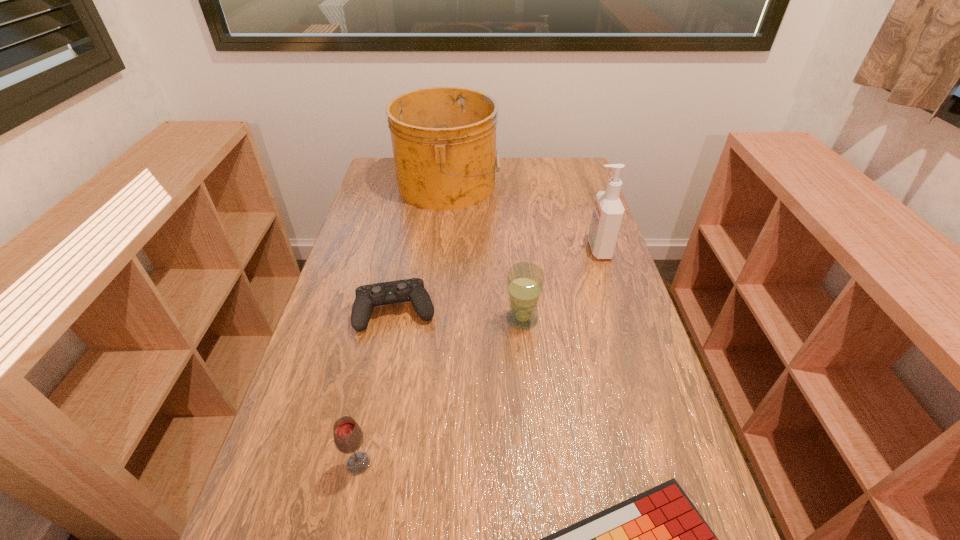
Identify the location of the closest object to the shortest object. The image size is (960, 540). (348, 437).

The image size is (960, 540). What are the coordinates of `object that can be found as the fifth closest to the control` in the screenshot? It's located at (608, 212).

This screenshot has height=540, width=960. Identify the location of free spot that satisfies the following two spatial constraints: 1. on the front label of the cleansing agent; 2. on the front side of the right glass drink container. (621, 319).

This screenshot has width=960, height=540. In order to click on vacant space that satisfies the following two spatial constraints: 1. on the back side of the bucket; 2. on the right side of the nearer glass drink container in this screenshot , I will do `click(417, 184)`.